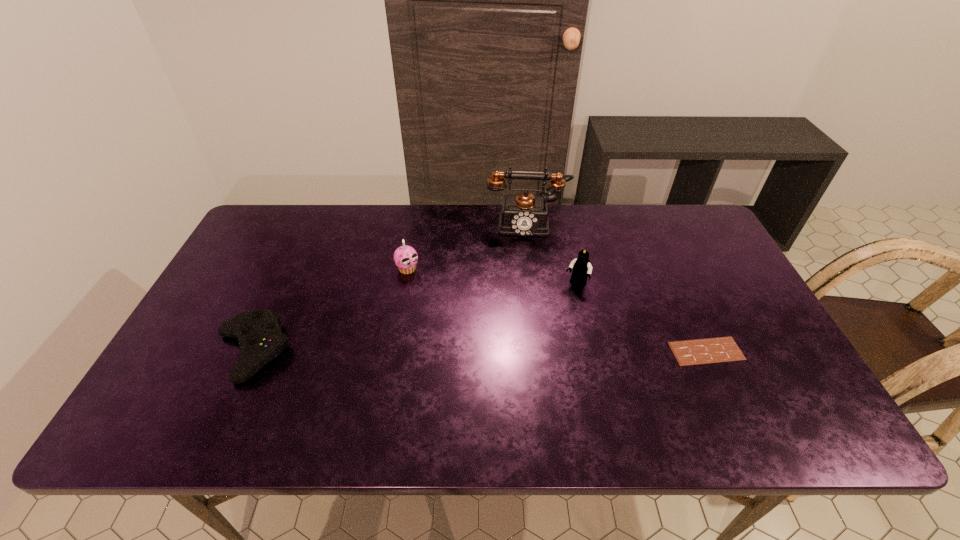
In order to click on free area in between the Lego and the fourth tallest object in this screenshot , I will do `click(414, 318)`.

The image size is (960, 540). In order to click on empty space between the second object from left to right and the fourth tallest object in this screenshot , I will do `click(329, 310)`.

I want to click on free space that is in between the Lego and the second object from left to right, so click(x=492, y=276).

The height and width of the screenshot is (540, 960). In order to click on vacant area between the Lego and the fourth tallest object in this screenshot , I will do `click(414, 318)`.

The width and height of the screenshot is (960, 540). I want to click on free spot between the fourth object from right to left and the Lego, so 492,276.

Find the location of a particular element. The height and width of the screenshot is (540, 960). empty space that is in between the cupcake and the Lego is located at coordinates (492, 276).

Identify the location of vacant region between the chocolate bar and the farthest object. (616, 287).

Find the location of a particular element. This screenshot has height=540, width=960. vacant area between the rightmost object and the fourth tallest object is located at coordinates (479, 351).

At what (x,y) coordinates should I click in order to perform the action: click on free area in between the leftmost object and the Lego. Please return your answer as a coordinate pair (x, y). This screenshot has height=540, width=960. Looking at the image, I should click on (414, 318).

The height and width of the screenshot is (540, 960). What are the coordinates of `object that is the third closest to the fourth tallest object` in the screenshot? It's located at (581, 267).